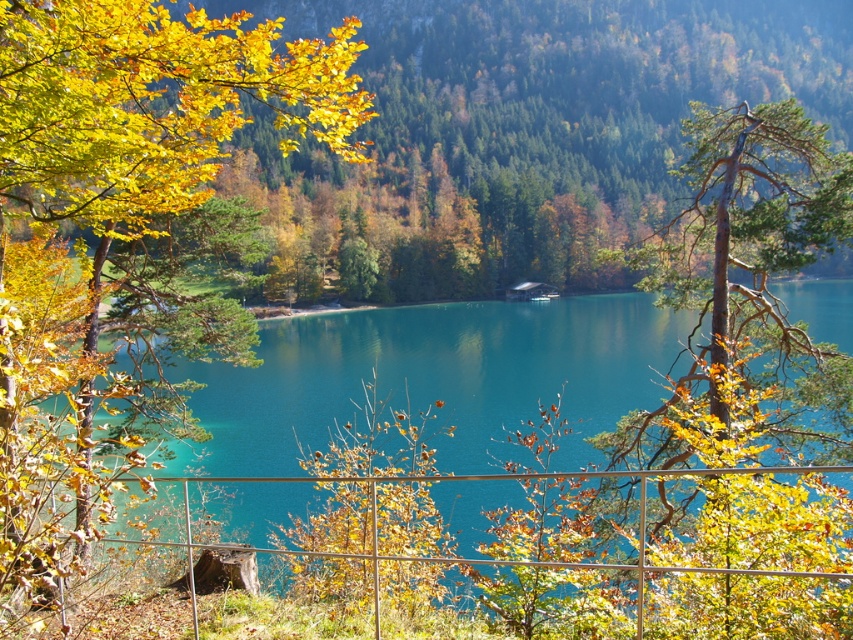
You are standing at the edge of the lake and want to take a photo of the yellow leafy tree at upper left and the turquoise glossy water at center. Which object should you frame first in your camera viewfinder to ensure both are in the shot?

You should frame the yellow leafy tree at upper left first because it is positioned to the left of the turquoise glossy water at center, so starting with the leftmost object ensures both are included in the viewfinder.

You are standing at the edge of the lake and want to take a photo of the yellow leafy tree at upper left and the turquoise glossy water at center. Which object should you focus on first to ensure both are in sharp focus?

You should focus on the yellow leafy tree at upper left first because it is closer to you than the turquoise glossy water at center. By focusing on the closer object, the background object may still be in acceptable focus depending on the aperture used.